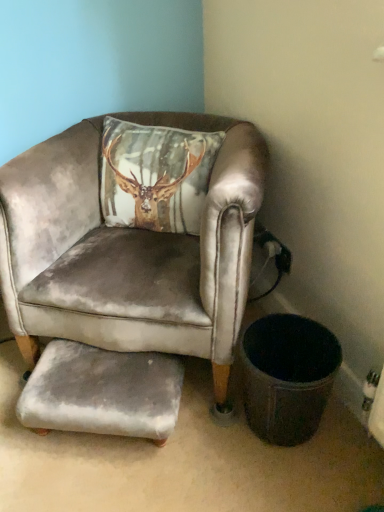
Question: From the image's perspective, does gray velvety footrest at lower center appear lower than velvet gray armchair at center?

Choices:
 (A) yes
 (B) no

Answer: (A)

Question: Would you say gray velvety footrest at lower center contains velvet gray armchair at center?

Choices:
 (A) no
 (B) yes

Answer: (A)

Question: Could you tell me if gray velvety footrest at lower center is facing velvet gray armchair at center?

Choices:
 (A) no
 (B) yes

Answer: (A)

Question: Can you confirm if gray velvety footrest at lower center is thinner than velvet gray armchair at center?

Choices:
 (A) no
 (B) yes

Answer: (B)

Question: Is gray velvety footrest at lower center completely or partially outside of velvet gray armchair at center?

Choices:
 (A) no
 (B) yes

Answer: (A)

Question: Considering the relative sizes of gray velvety footrest at lower center and velvet gray armchair at center in the image provided, is gray velvety footrest at lower center wider than velvet gray armchair at center?

Choices:
 (A) yes
 (B) no

Answer: (B)

Question: Does velvet gray armchair at center appear on the right side of gray velvety footrest at lower center?

Choices:
 (A) no
 (B) yes

Answer: (B)

Question: From the image's perspective, is velvet gray armchair at center located beneath gray velvety footrest at lower center?

Choices:
 (A) yes
 (B) no

Answer: (B)

Question: Is velvet gray armchair at center positioned far away from gray velvety footrest at lower center?

Choices:
 (A) no
 (B) yes

Answer: (A)

Question: Does velvet gray armchair at center touch gray velvety footrest at lower center?

Choices:
 (A) yes
 (B) no

Answer: (B)

Question: From a real-world perspective, is velvet gray armchair at center over gray velvety footrest at lower center?

Choices:
 (A) no
 (B) yes

Answer: (B)

Question: Can you confirm if velvet gray armchair at center is taller than gray velvety footrest at lower center?

Choices:
 (A) yes
 (B) no

Answer: (A)

Question: Looking at their shapes, would you say gray velvety footrest at lower center is wider or thinner than velvet gray armchair at center?

Choices:
 (A) wide
 (B) thin

Answer: (B)